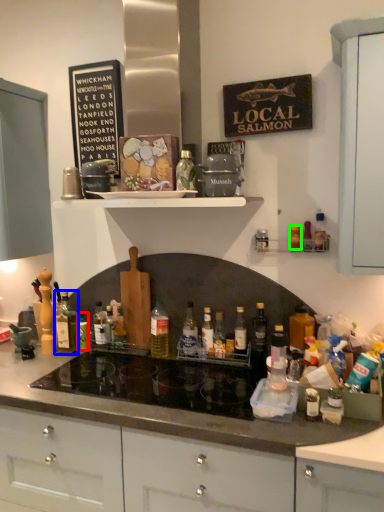
Question: Which object is the farthest from bottle (highlighted by a red box)? Choose among these: bottle (highlighted by a blue box) or bottle (highlighted by a green box).

Choices:
 (A) bottle
 (B) bottle

Answer: (B)